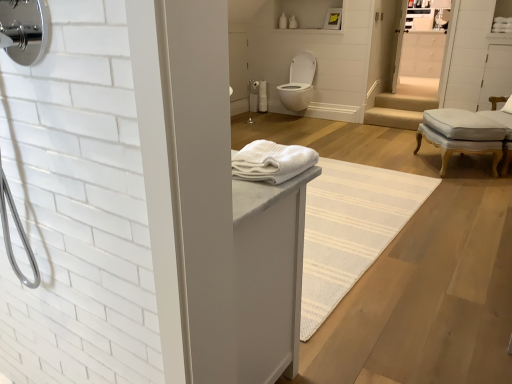
Question: Does white glossy toilet at center have a smaller size compared to white soft towel at center?

Choices:
 (A) yes
 (B) no

Answer: (B)

Question: From the image's perspective, is white glossy toilet at center beneath white soft towel at center?

Choices:
 (A) no
 (B) yes

Answer: (A)

Question: Is white soft towel at center located within white glossy toilet at center?

Choices:
 (A) yes
 (B) no

Answer: (B)

Question: Does white glossy toilet at center appear on the right side of white soft towel at center?

Choices:
 (A) no
 (B) yes

Answer: (B)

Question: Considering the relative sizes of white glossy toilet at center and white soft towel at center in the image provided, is white glossy toilet at center bigger than white soft towel at center?

Choices:
 (A) yes
 (B) no

Answer: (A)

Question: From a real-world perspective, is white soft towel at center physically located above or below white glossy toilet at center?

Choices:
 (A) below
 (B) above

Answer: (B)

Question: Is white soft towel at center in front of or behind white glossy toilet at center in the image?

Choices:
 (A) front
 (B) behind

Answer: (A)

Question: Does point (297, 165) appear closer or farther from the camera than point (309, 87)?

Choices:
 (A) farther
 (B) closer

Answer: (B)

Question: Based on their sizes in the image, would you say white soft towel at center is bigger or smaller than white glossy toilet at center?

Choices:
 (A) big
 (B) small

Answer: (B)

Question: From the image's perspective, is white soft towel at center above or below light gray fabric ottoman at right?

Choices:
 (A) below
 (B) above

Answer: (A)

Question: Does point (240, 165) appear closer or farther from the camera than point (424, 132)?

Choices:
 (A) farther
 (B) closer

Answer: (B)

Question: Looking at their shapes, would you say white soft towel at center is wider or thinner than light gray fabric ottoman at right?

Choices:
 (A) wide
 (B) thin

Answer: (B)

Question: From a real-world perspective, is white soft towel at center physically located above or below light gray fabric ottoman at right?

Choices:
 (A) above
 (B) below

Answer: (A)

Question: In the image, is white glossy toilet at center on the left side or the right side of light gray fabric ottoman at right?

Choices:
 (A) left
 (B) right

Answer: (A)

Question: Relative to light gray fabric ottoman at right, is white glossy toilet at center in front or behind?

Choices:
 (A) behind
 (B) front

Answer: (A)